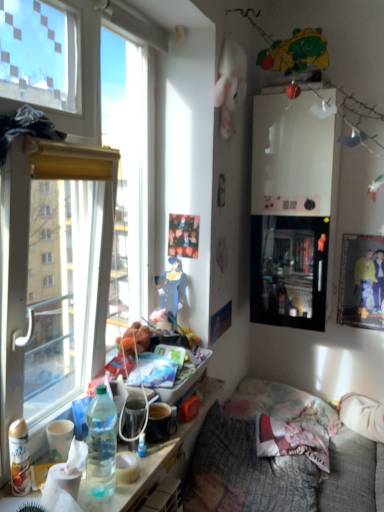
Question: Can you confirm if blue denim dress at center is positioned to the left of textured gray fabric couch at lower right?

Choices:
 (A) no
 (B) yes

Answer: (B)

Question: From a real-world perspective, is blue denim dress at center on top of textured gray fabric couch at lower right?

Choices:
 (A) no
 (B) yes

Answer: (B)

Question: Is blue denim dress at center touching textured gray fabric couch at lower right?

Choices:
 (A) yes
 (B) no

Answer: (B)

Question: Does blue denim dress at center have a larger size compared to textured gray fabric couch at lower right?

Choices:
 (A) yes
 (B) no

Answer: (B)

Question: Is blue denim dress at center not within textured gray fabric couch at lower right?

Choices:
 (A) no
 (B) yes

Answer: (B)

Question: From the image's perspective, is blue denim dress at center on top of textured gray fabric couch at lower right?

Choices:
 (A) yes
 (B) no

Answer: (A)

Question: Is translucent plastic water bottle at lower left shorter than plush green bear at upper right?

Choices:
 (A) yes
 (B) no

Answer: (A)

Question: Considering the relative sizes of translucent plastic water bottle at lower left and plush green bear at upper right in the image provided, is translucent plastic water bottle at lower left smaller than plush green bear at upper right?

Choices:
 (A) no
 (B) yes

Answer: (B)

Question: Does translucent plastic water bottle at lower left have a larger size compared to plush green bear at upper right?

Choices:
 (A) no
 (B) yes

Answer: (A)

Question: Does translucent plastic water bottle at lower left lie behind plush green bear at upper right?

Choices:
 (A) yes
 (B) no

Answer: (B)

Question: Is translucent plastic water bottle at lower left outside of plush green bear at upper right?

Choices:
 (A) no
 (B) yes

Answer: (B)

Question: Is translucent plastic water bottle at lower left to the left of plush green bear at upper right from the viewer's perspective?

Choices:
 (A) yes
 (B) no

Answer: (A)

Question: Does plush green bear at upper right turn towards translucent plastic water bottle at lower left?

Choices:
 (A) yes
 (B) no

Answer: (B)